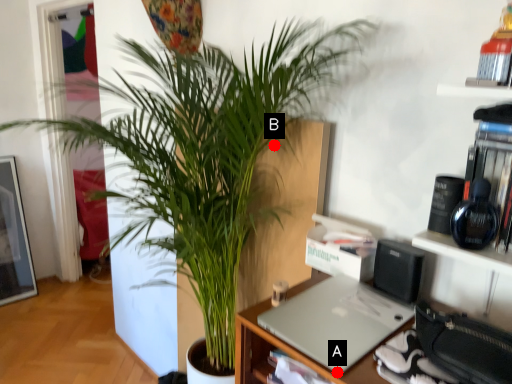
Question: Two points are circled on the image, labeled by A and B beside each circle. Which point is farther from the camera taking this photo?

Choices:
 (A) A is further
 (B) B is further

Answer: (B)